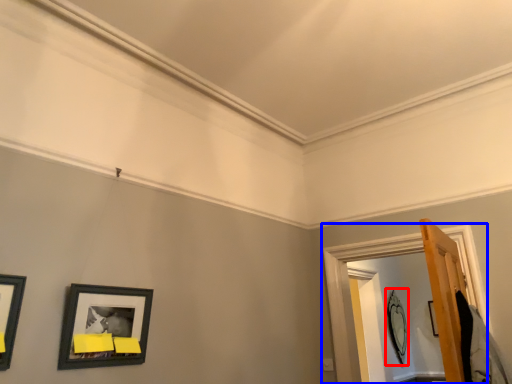
Question: Which point is closer to the camera, picture frame (highlighted by a red box) or window frame (highlighted by a blue box)?

Choices:
 (A) picture frame
 (B) window frame

Answer: (B)